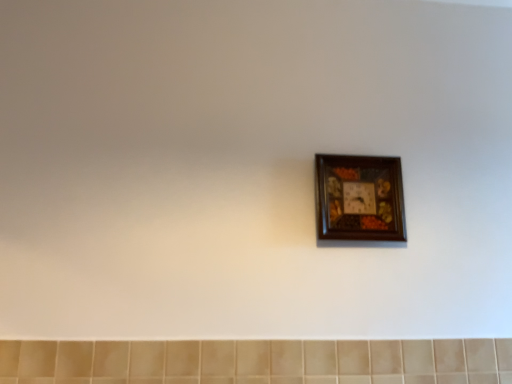
Question: Is wooden picture frame at center inside or outside of beige ceramic tile at bottom?

Choices:
 (A) outside
 (B) inside

Answer: (A)

Question: Visually, is wooden picture frame at center positioned to the left or to the right of beige ceramic tile at bottom?

Choices:
 (A) left
 (B) right

Answer: (B)

Question: From a real-world perspective, is wooden picture frame at center above or below beige ceramic tile at bottom?

Choices:
 (A) above
 (B) below

Answer: (A)

Question: Is beige ceramic tile at bottom to the left or to the right of wooden picture frame at center in the image?

Choices:
 (A) left
 (B) right

Answer: (A)

Question: Considering the positions of beige ceramic tile at bottom and wooden picture frame at center in the image, is beige ceramic tile at bottom bigger or smaller than wooden picture frame at center?

Choices:
 (A) big
 (B) small

Answer: (A)

Question: In terms of height, does beige ceramic tile at bottom look taller or shorter compared to wooden picture frame at center?

Choices:
 (A) short
 (B) tall

Answer: (A)

Question: Is beige ceramic tile at bottom inside the boundaries of wooden picture frame at center, or outside?

Choices:
 (A) outside
 (B) inside

Answer: (A)